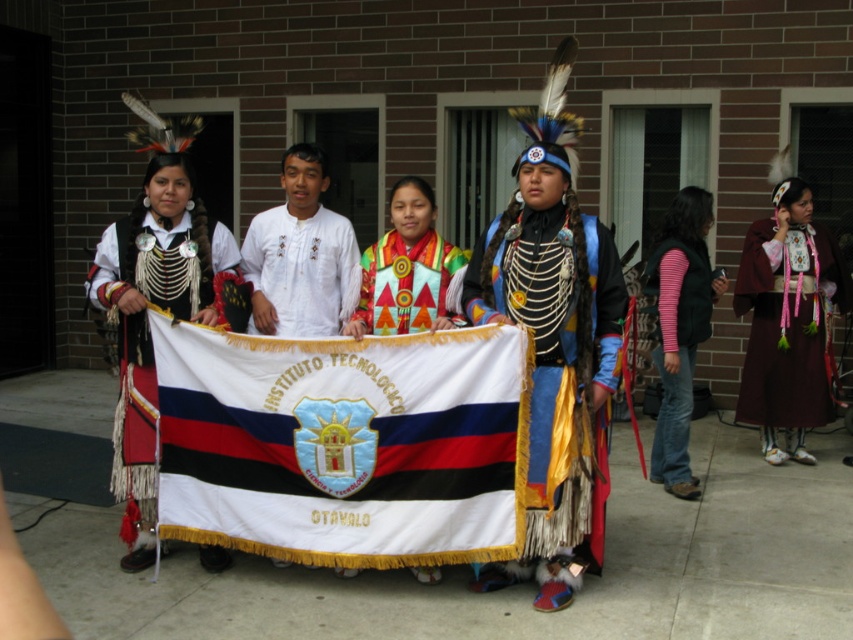
Question: Which object is the farthest from the white cotton shirt at center?

Choices:
 (A) matte black and white fabric at center
 (B) embroidered fabric shawl at center
 (C) white fabric flag at center

Answer: (C)

Question: Is matte black and white fabric at center wider than maroon velvet dress at right?

Choices:
 (A) yes
 (B) no

Answer: (B)

Question: Among these objects, which one is farthest from the camera?

Choices:
 (A) maroon velvet dress at right
 (B) shiny metallic headdress at center

Answer: (A)

Question: Which is farther from the textured fabric vest at center?

Choices:
 (A) white fabric flag at center
 (B) pink striped sleeve at lower right

Answer: (B)

Question: Can you confirm if white fabric flag at center is bigger than white cotton shirt at center?

Choices:
 (A) yes
 (B) no

Answer: (A)

Question: Does white cotton shirt at center come in front of textured fabric vest at center?

Choices:
 (A) yes
 (B) no

Answer: (B)